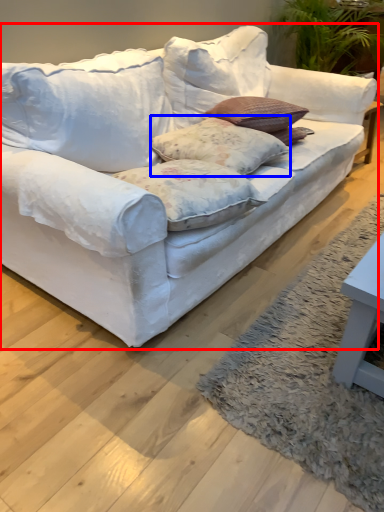
Question: Which of the following is the farthest to the observer, studio couch (highlighted by a red box) or pillow (highlighted by a blue box)?

Choices:
 (A) studio couch
 (B) pillow

Answer: (B)